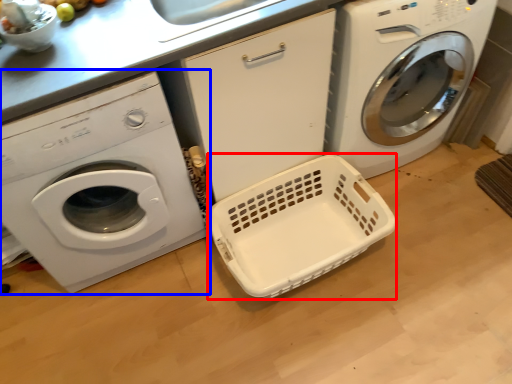
Question: Which object appears farthest to the camera in this image, basket container (highlighted by a red box) or washing machine (highlighted by a blue box)?

Choices:
 (A) basket container
 (B) washing machine

Answer: (A)